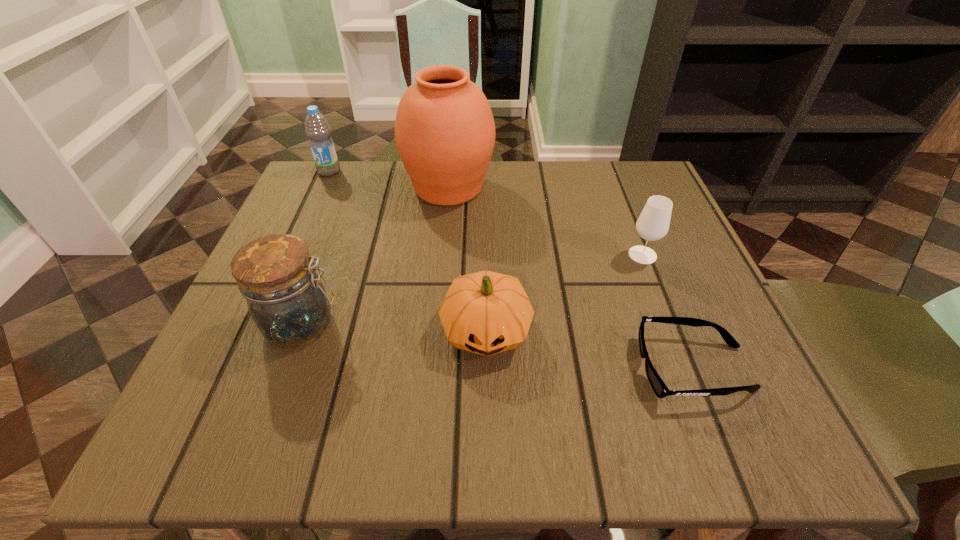
Image resolution: width=960 pixels, height=540 pixels. I want to click on urn, so click(x=444, y=129).

At what (x,y) coordinates should I click in order to perform the action: click on water bottle. Please return your answer as a coordinate pair (x, y). The image size is (960, 540). Looking at the image, I should click on (317, 129).

Identify the location of jar. (286, 299).

At what (x,y) coordinates should I click in order to perform the action: click on the third farthest object. Please return your answer as a coordinate pair (x, y). Looking at the image, I should click on (653, 223).

The image size is (960, 540). What are the coordinates of `gourd` in the screenshot? It's located at (486, 313).

Where is `sunglasses`? The width and height of the screenshot is (960, 540). sunglasses is located at coordinates (660, 389).

You are a GUI agent. You are given a task and a screenshot of the screen. Output one action in this format:
    pyautogui.click(x=<x>, y=<y>)
    Task: Click on the blank space located 0.340m on the front of the urn
    This screenshot has width=960, height=540.
    Given the screenshot: What is the action you would take?
    pyautogui.click(x=435, y=344)

Locate an element on the screen. free space located on the right of the water bottle is located at coordinates (402, 171).

Locate an element on the screen. The height and width of the screenshot is (540, 960). free region located on the lid of the jar is located at coordinates (455, 324).

At what (x,y) coordinates should I click in order to perform the action: click on vacant region located 0.300m on the left of the glass. Please return your answer as a coordinate pair (x, y). Looking at the image, I should click on (473, 255).